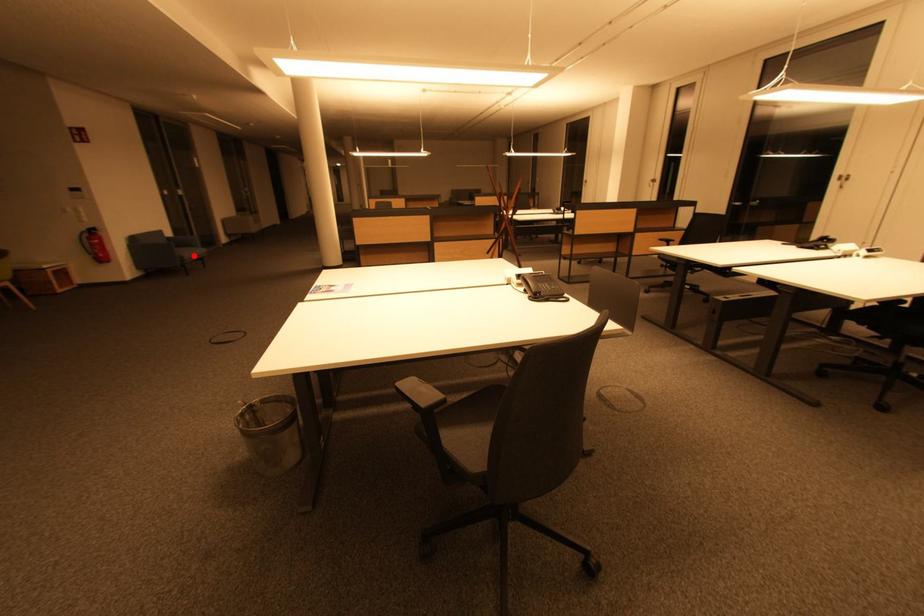
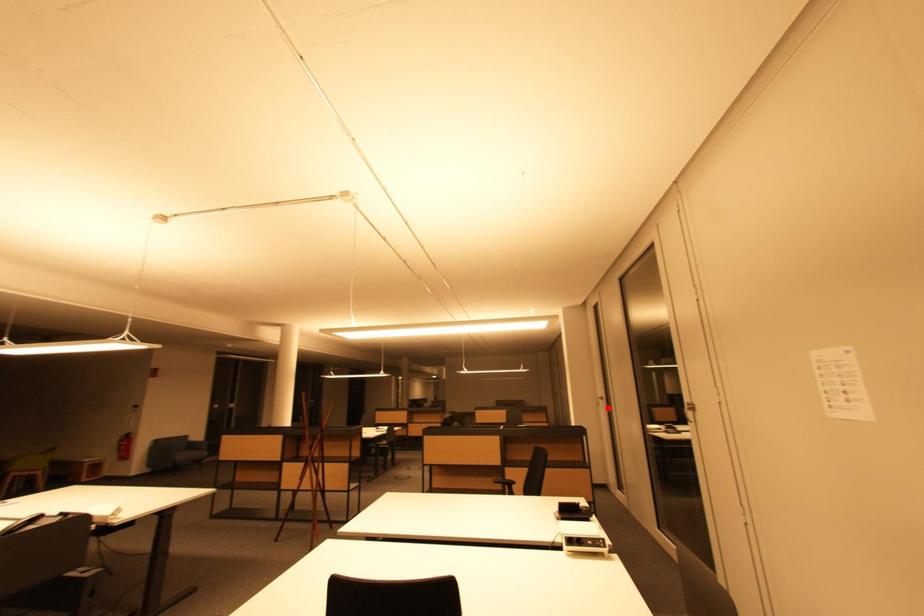
I am providing you with two images of the same scene from different viewpoints. A red point is marked on the first image and another point is marked on the second image. Is the marked point in image1 the same physical position as the marked point in image2?

No